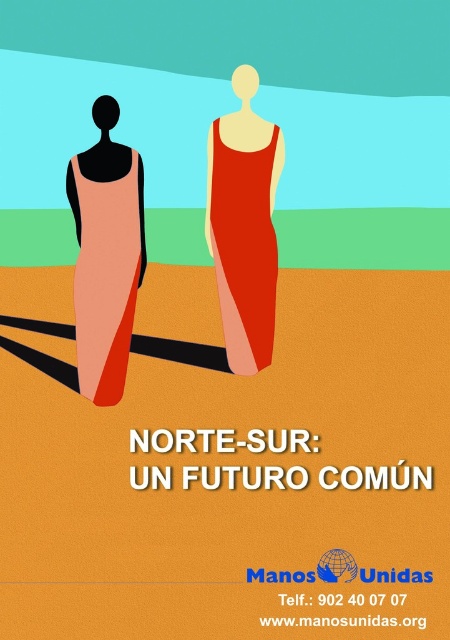
You are an artist designing a poster and need to arrange the matte red dress at center and the matte peach dress at left. According to the image, which dress is placed above the other?

The matte red dress at center is positioned over the matte peach dress at left, meaning it is placed above the other.

You are designing a poster and need to place a text box between the matte red dress at center and the matte peach dress at left. Which dress should the text box be closer to if it needs to be aligned with the right edge of the poster?

The text box should be closer to the matte red dress at center because it is positioned to the right of the matte peach dress at left, so aligning it with the right edge would place it near the matte red dress at center.

You are an art director reviewing a design proposal. You notice the matte peach dress at left and the matte red dress at center in the image. Which dress is positioned closer to the viewer?

The matte red dress at center is closer to the viewer because the matte peach dress at left is behind it.